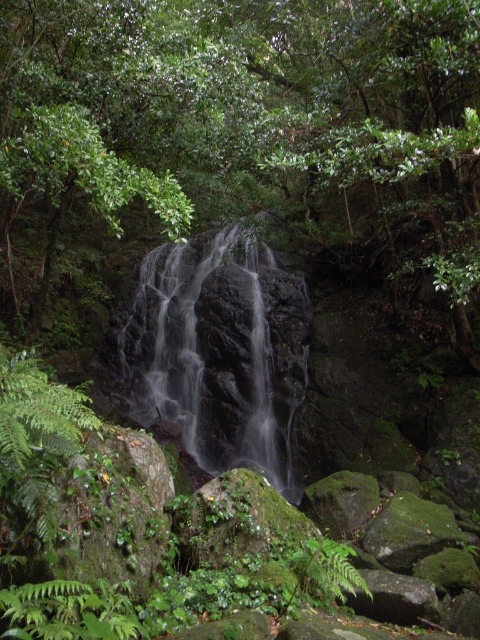
Question: Which point is closer to the camera?

Choices:
 (A) translucent glass waterfall at center
 (B) green leafy tree at center

Answer: (B)

Question: Can you confirm if green leafy tree at center is wider than translucent glass waterfall at center?

Choices:
 (A) yes
 (B) no

Answer: (A)

Question: Is green leafy tree at center smaller than translucent glass waterfall at center?

Choices:
 (A) no
 (B) yes

Answer: (A)

Question: Does green leafy tree at center lie behind translucent glass waterfall at center?

Choices:
 (A) yes
 (B) no

Answer: (B)

Question: Which object appears closest to the camera in this image?

Choices:
 (A) translucent glass waterfall at center
 (B) green leafy tree at center

Answer: (B)